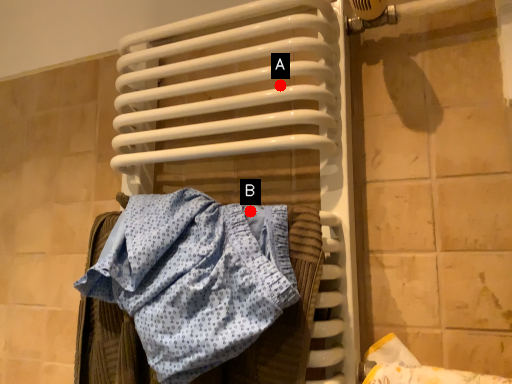
Question: Two points are circled on the image, labeled by A and B beside each circle. Which point is further to the camera?

Choices:
 (A) A is further
 (B) B is further

Answer: (A)